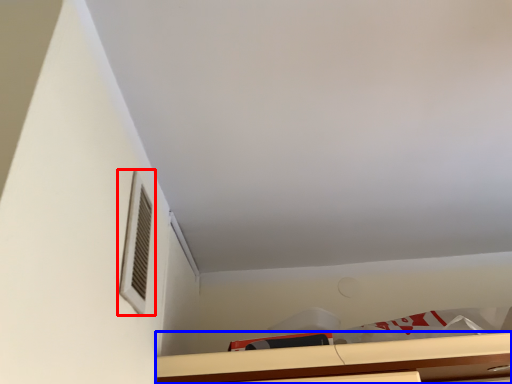
Question: Which object appears farthest to the camera in this image, window (highlighted by a red box) or cabinetry (highlighted by a blue box)?

Choices:
 (A) window
 (B) cabinetry

Answer: (B)